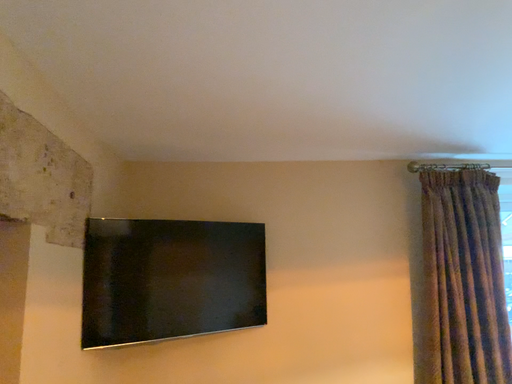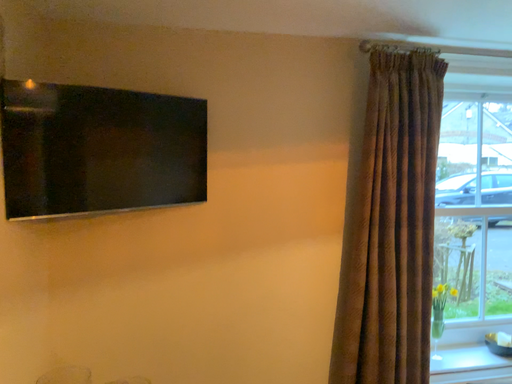
Question: How did the camera likely rotate when shooting the video?

Choices:
 (A) rotated downward
 (B) rotated upward

Answer: (A)